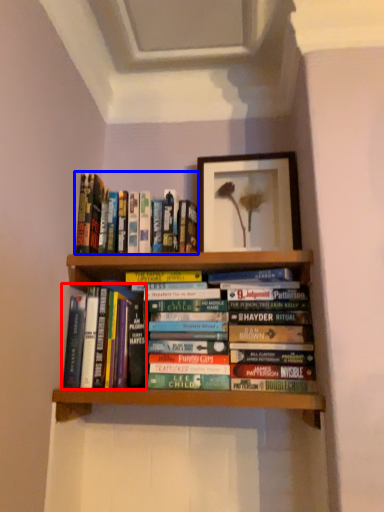
Question: Which object appears farthest to the camera in this image, book (highlighted by a red box) or book (highlighted by a blue box)?

Choices:
 (A) book
 (B) book

Answer: (B)